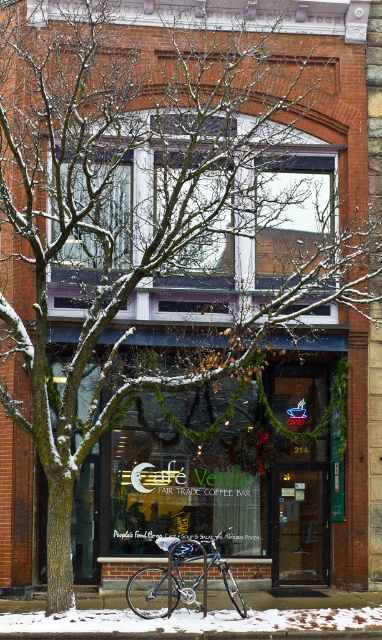
Can you confirm if white powdery snow at lower center is positioned above shiny blue bicycle at center?

Actually, white powdery snow at lower center is below shiny blue bicycle at center.

Between point (370, 627) and point (236, 588), which one is positioned behind?

Positioned behind is point (236, 588).

Who is more distant from viewer, (126, 616) or (189, 554)?

Positioned behind is point (189, 554).

Find the location of a particular element. white powdery snow at lower center is located at coordinates (194, 625).